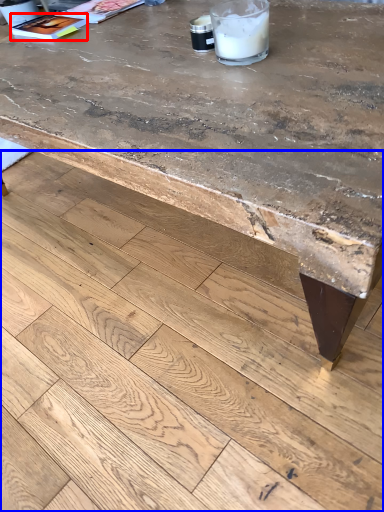
Question: Which point is further to the camera, magazine (highlighted by a red box) or concrete (highlighted by a blue box)?

Choices:
 (A) magazine
 (B) concrete

Answer: (A)